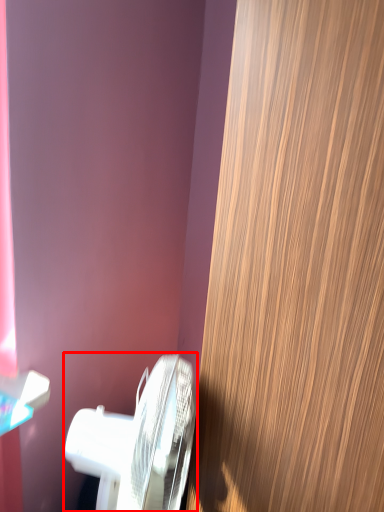
Question: From the image's perspective, what is the correct spatial relationship of toilet (annotated by the red box) in relation to door?

Choices:
 (A) below
 (B) above

Answer: (A)